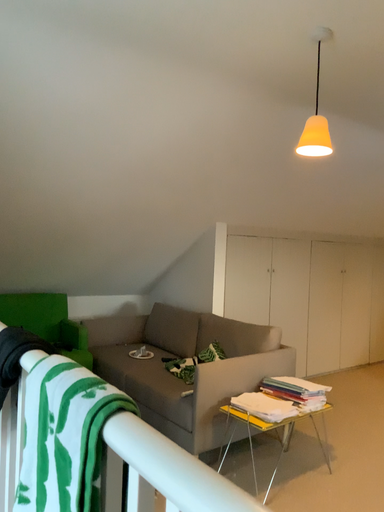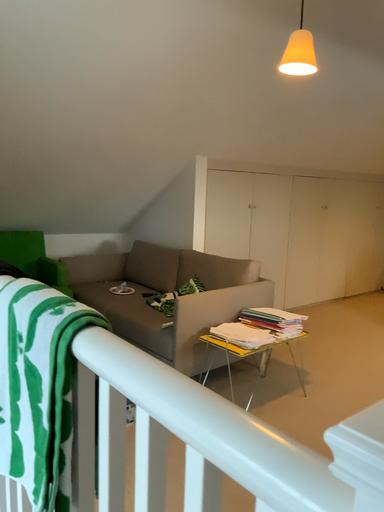
Question: Which way did the camera rotate in the video?

Choices:
 (A) rotated downward
 (B) rotated upward

Answer: (A)